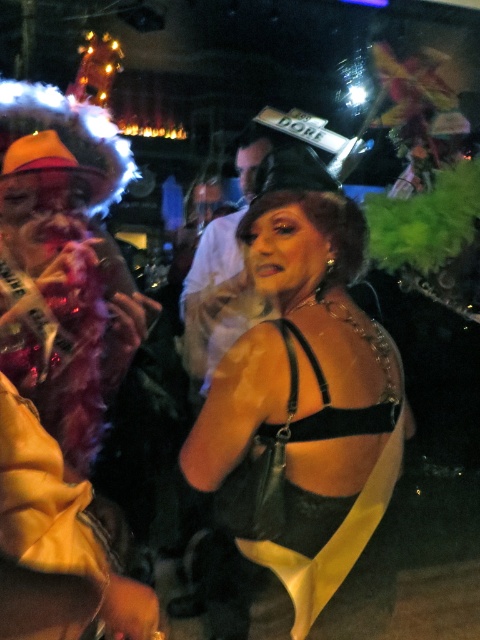
You are at a party and want to take a photo of the velvet black dress at center and the matte black tank top at center. Which one should you focus on first to ensure both are in focus?

You should focus on the velvet black dress at center first because it is closer to the viewer than the matte black tank top at center, so adjusting focus from near to far will help both be in focus.

You are at a party and want to take a photo of the velvet black dress at center. Where should you point your camera?

You should point your camera to the position at point coordinates (x=325, y=392) to capture the velvet black dress at center.